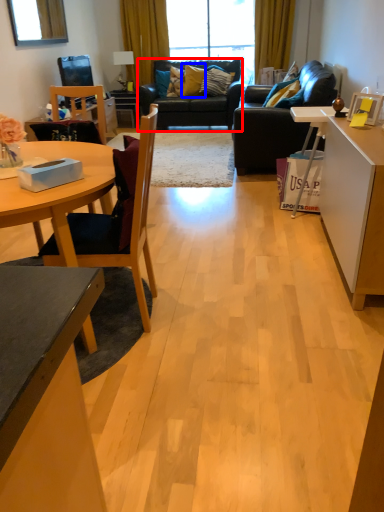
Question: Which object is further to the camera taking this photo, studio couch (highlighted by a red box) or pillow (highlighted by a blue box)?

Choices:
 (A) studio couch
 (B) pillow

Answer: (B)